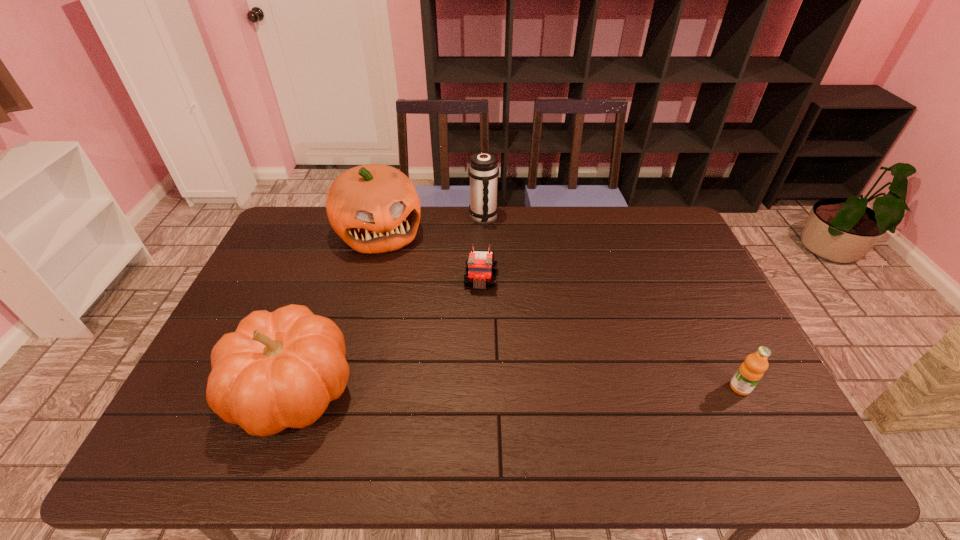
Identify which object is the fourth closest to the thermos bottle. Please provide its 2D coordinates. Your answer should be formatted as a tuple, i.e. [(x, y)], where the tuple contains the x and y coordinates of a point satisfying the conditions above.

[(750, 372)]

Find the location of `vacant position in the image that satisfies the following two spatial constraints: 1. on the front side of the third nearest object; 2. on the left side of the farther pumpkin`. vacant position in the image that satisfies the following two spatial constraints: 1. on the front side of the third nearest object; 2. on the left side of the farther pumpkin is located at coordinates (367, 280).

This screenshot has width=960, height=540. I want to click on free space that satisfies the following two spatial constraints: 1. on the back side of the nearer pumpkin; 2. on the label of the fourth tallest object, so click(x=293, y=388).

Image resolution: width=960 pixels, height=540 pixels. I want to click on free spot that satisfies the following two spatial constraints: 1. on the front side of the Lego; 2. on the label of the second shortest object, so click(x=481, y=388).

The width and height of the screenshot is (960, 540). I want to click on free location that satisfies the following two spatial constraints: 1. on the front side of the rightmost object; 2. on the label of the farther pumpkin, so click(337, 388).

Locate an element on the screen. free spot that satisfies the following two spatial constraints: 1. on the back side of the farther pumpkin; 2. on the left side of the nearer pumpkin is located at coordinates (348, 232).

Locate an element on the screen. Image resolution: width=960 pixels, height=540 pixels. vacant region that satisfies the following two spatial constraints: 1. on the front side of the Lego; 2. on the label of the fourth tallest object is located at coordinates (481, 388).